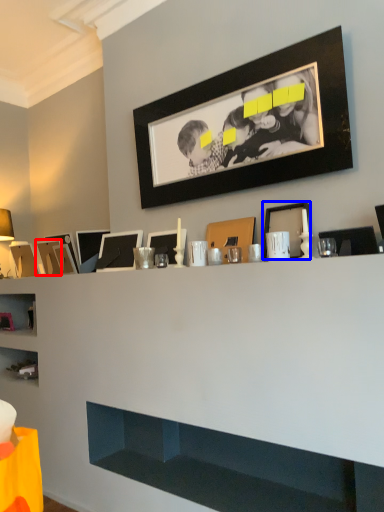
Question: Which object is closer to the camera taking this photo, picture frame (highlighted by a red box) or picture frame (highlighted by a blue box)?

Choices:
 (A) picture frame
 (B) picture frame

Answer: (B)